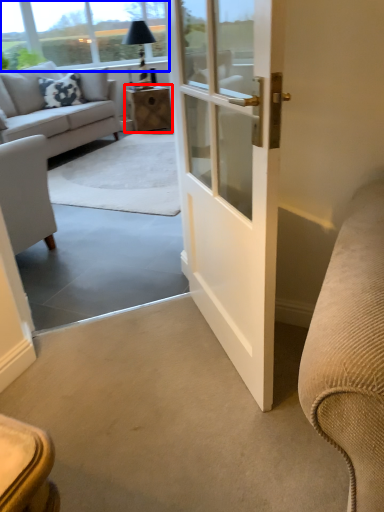
Question: Which of the following is the closest to the observer, table (highlighted by a red box) or window screen (highlighted by a blue box)?

Choices:
 (A) table
 (B) window screen

Answer: (B)